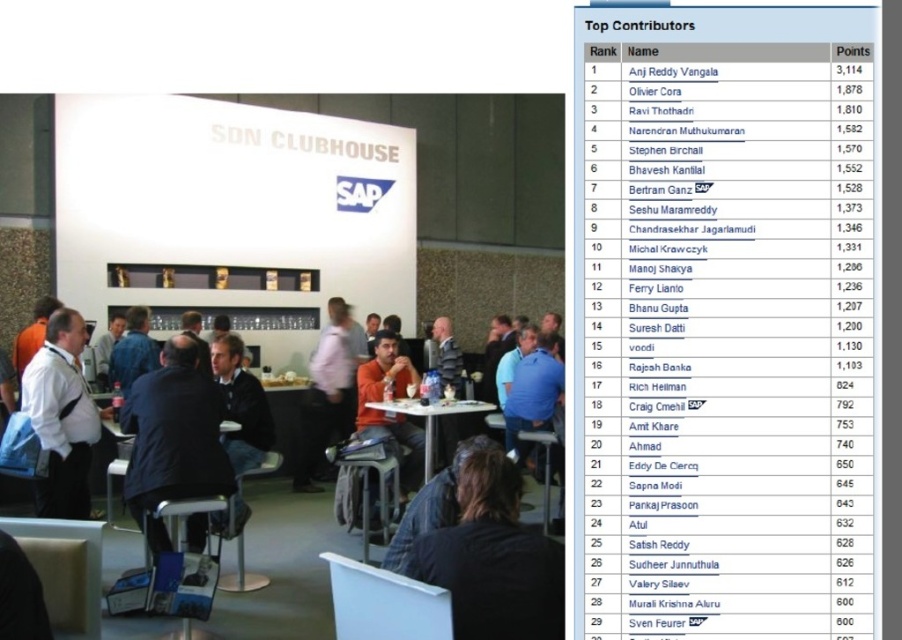
You are attending an SAP event and notice an orange matte shirt at center and a matte black table at center. Which object appears narrower in the image?

The orange matte shirt at center is narrower than the matte black table at center.

You are a photographer at the SAP event and need to capture a photo of the dark blue suit at center and the white plastic table at center. From the photographer perspective, which object is on the left side?

The dark blue suit at center is positioned on the left side of the white plastic table at center, so from the photographer perspective, the dark blue suit at center is on the left side.